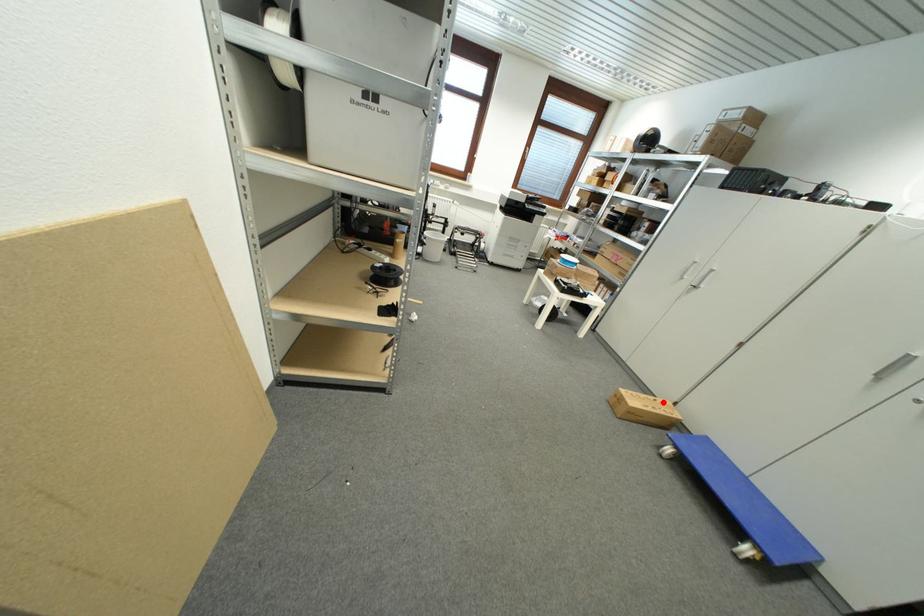
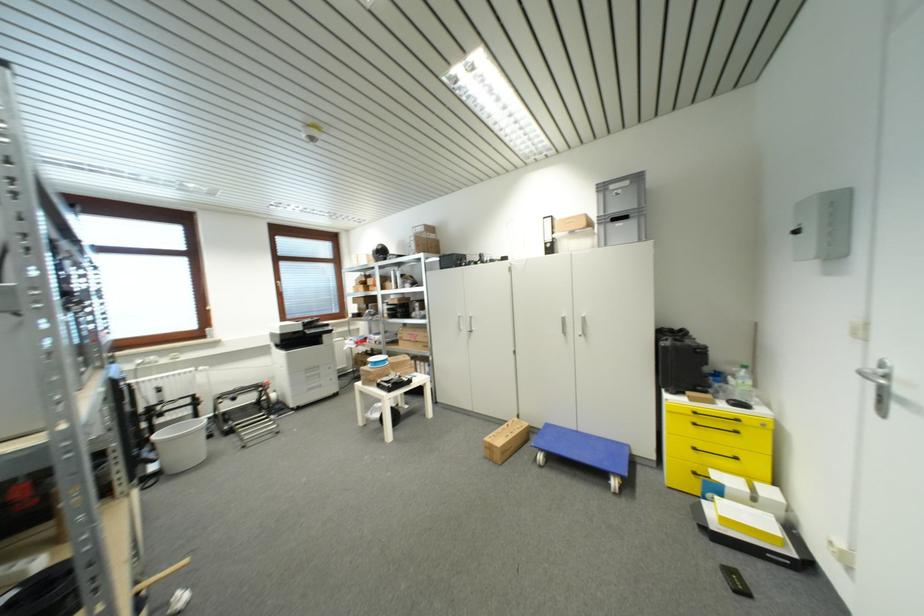
Where in the second image is the point corresponding to the highlighted location from the first image?

(514, 426)